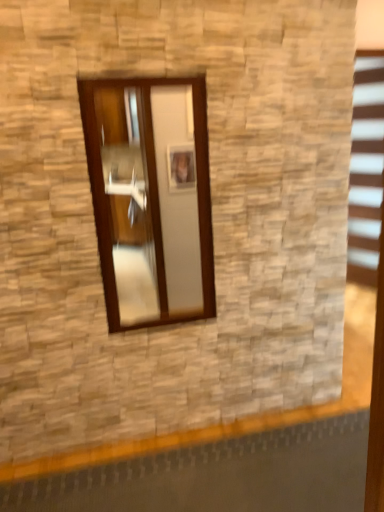
Describe the element at coordinates (151, 197) in the screenshot. I see `wooden-framed mirror at center` at that location.

Locate an element on the screen. wooden-framed mirror at center is located at coordinates (151, 197).

The width and height of the screenshot is (384, 512). Identify the location of wooden-framed mirror at center. (151, 197).